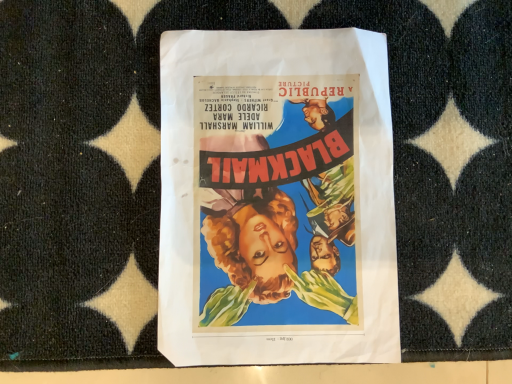
You are a GUI agent. You are given a task and a screenshot of the screen. Output one action in this format:
    pyautogui.click(x=<x>, y=<y>)
    Task: Click on the free space above vibrant paper poster at center (from a real-world perspective)
    This screenshot has height=384, width=512.
    Given the screenshot: What is the action you would take?
    pyautogui.click(x=275, y=189)